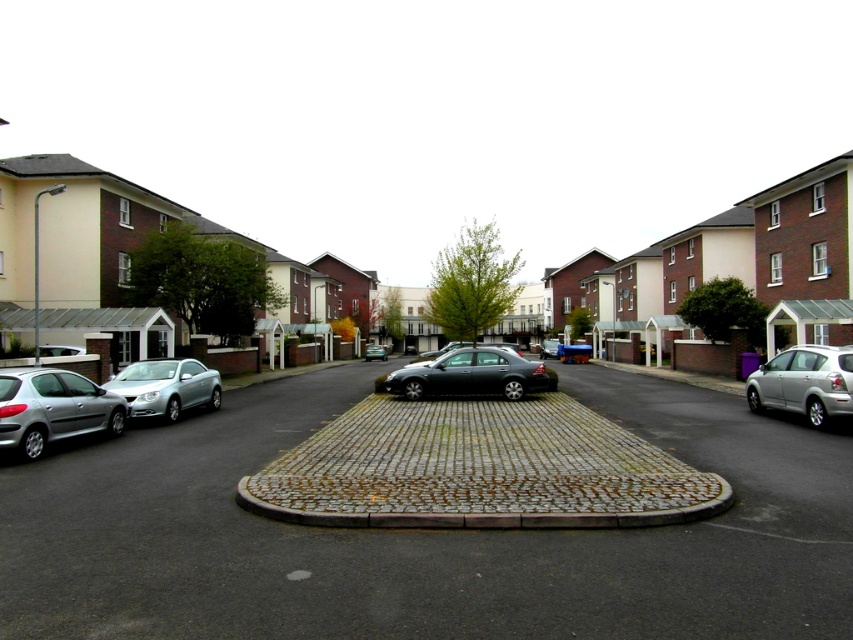
Based on the photo, can you confirm if silver metallic hatchback at right is taller than matte silver car at center?

Incorrect, silver metallic hatchback at right's height is not larger of matte silver car at center's.

Find the location of `silver metallic hatchback at right`. silver metallic hatchback at right is located at coordinates (804, 381).

Does shiny black sedan at center have a smaller size compared to silver metallic car at left?

No, shiny black sedan at center is not smaller than silver metallic car at left.

Does shiny black sedan at center appear over silver metallic car at left?

Yes, shiny black sedan at center is above silver metallic car at left.

Is point (527, 364) farther from camera compared to point (148, 388)?

Yes, it is.

Locate an element on the screen. The height and width of the screenshot is (640, 853). shiny black sedan at center is located at coordinates (469, 376).

Is silver metallic hatchback at left below silver metallic car at left?

No, silver metallic hatchback at left is not below silver metallic car at left.

Is point (97, 429) in front of point (181, 362)?

Yes, point (97, 429) is in front of point (181, 362).

The width and height of the screenshot is (853, 640). Identify the location of silver metallic hatchback at left. (53, 408).

Identify the location of silver metallic hatchback at left. (53, 408).